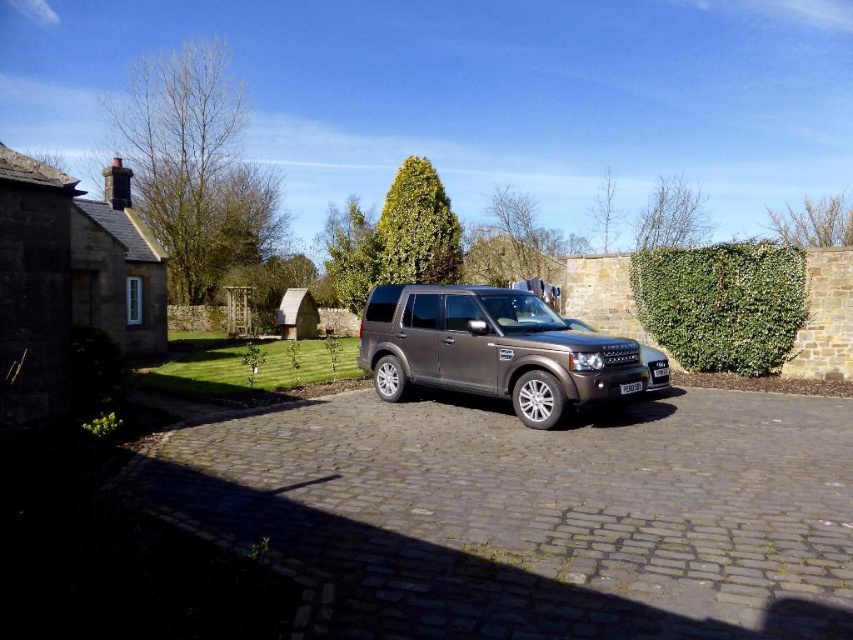
Between brown cobblestone driveway at center and green leafy hedge at right, which one has less height?

Standing shorter between the two is brown cobblestone driveway at center.

Where is `brown cobblestone driveway at center`? brown cobblestone driveway at center is located at coordinates coord(532,515).

Can you confirm if metallic gray suv at center is positioned above black plastic license plate at center?

Correct, metallic gray suv at center is located above black plastic license plate at center.

Who is more forward, (x=370, y=310) or (x=630, y=390)?

Point (x=630, y=390) is more forward.

Find the location of `metallic gray suv at center`. metallic gray suv at center is located at coordinates (491, 349).

Based on the photo, is brown cobblestone driveway at center to the right of black plastic license plate at center from the viewer's perspective?

In fact, brown cobblestone driveway at center is to the left of black plastic license plate at center.

Which is behind, point (410, 600) or point (630, 392)?

The point (630, 392) is more distant.

Where is `brown cobblestone driveway at center`? Image resolution: width=853 pixels, height=640 pixels. brown cobblestone driveway at center is located at coordinates (532, 515).